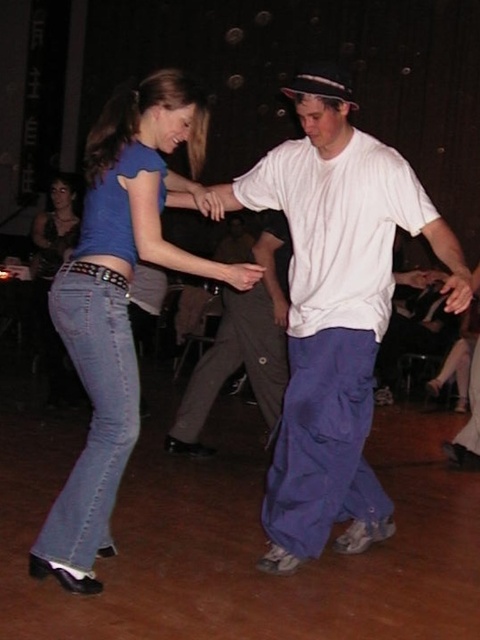
You are a photographer at the event and want to take a photo of the white cotton shirt at center and dark gray pants at center. The camera you have can focus on objects within 5 feet of each other. Will both subjects be in focus?

The white cotton shirt at center and dark gray pants at center are 4.52 feet apart, which is within the 5 feet range, so both subjects will be in focus.

Based on the photo, you are standing at the entrance of the dance floor and see two people dancing at center. The woman is wearing denim jeans at center and the man is wearing dark gray pants at center. Which clothing item is positioned higher on their bodies?

The denim jeans at center is located above the dark gray pants at center, so the denim jeans at center is positioned higher on their bodies.

You are at a party and want to know if the dark gray pants at center are positioned to the right of the denim jeans at left. Can you confirm this based on the scene?

Yes, the dark gray pants at center is to the right of denim jeans at left according to the description.